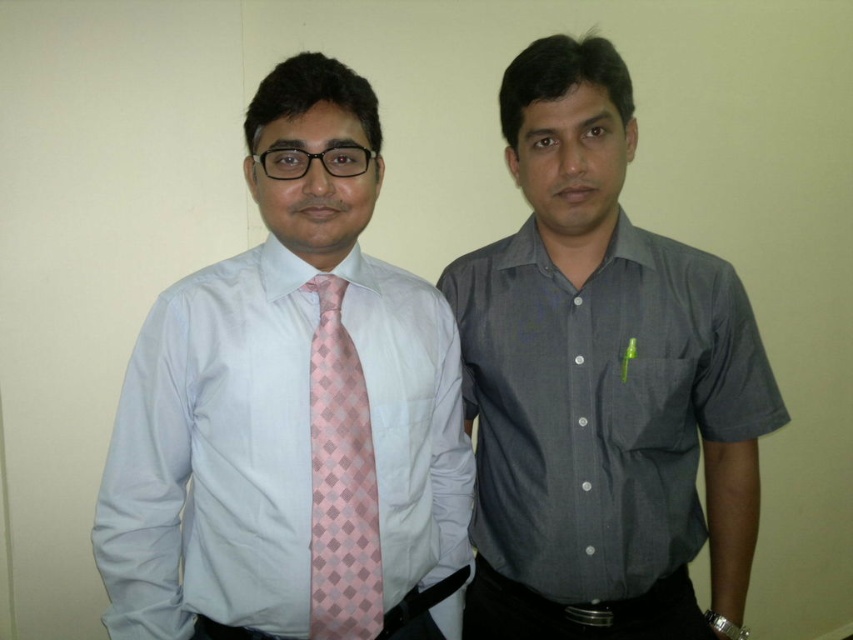
You are a photographer setting up for a portrait session. You need to ensure that the matte pink tie at left and the black leather belt at lower center are both visible in the final shot. Based on their positions, which one is higher up in the frame?

The matte pink tie at left is above the black leather belt at lower center, so the matte pink tie at left is higher up in the frame.

You are a photographer setting up for a group photo. You notice the dark gray shirt at center and the pink silk tie at left in your frame. Which object is positioned more to the left side of the image?

The pink silk tie at left is positioned more to the left side of the image than the dark gray shirt at center.

You are standing in front of two people. There is a point at coordinates point (396, 616). Can you reach that point with your hand if you are 5 feet tall?

The distance between point (396, 616) and the viewer is 3.64 feet. Since you are 5 feet tall, you can reach up to about 4.5 feet. Therefore, you can reach the point (396, 616) with your hand.